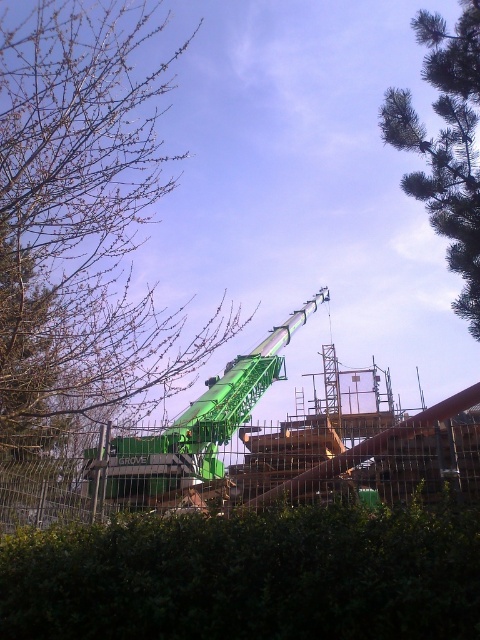
You are a construction worker on the site and need to secure a safety net between the metal wire fence at lower center and the green matte crane at center. Given their sizes, which object should the safety net be anchored to first?

The safety net should be anchored to the green matte crane at center first because it is larger than the metal wire fence at lower center, providing a more stable anchor point.

You are a construction worker carrying a tool box that is 3 meters wide. You are standing in front of the green leafy hedge at lower center and want to walk towards the camera. Is there enough space to pass through without hitting the hedge?

The distance between the green leafy hedge at lower center and the camera is 2.95 meters. Since your tool box is 3 meters wide, it is slightly wider than the available space. Therefore, you might hit the hedge if you try to pass through.

You are an inspector standing at the construction site and need to assess the visibility of the crane operator. The crane operator needs to see both the bare branches at upper left and the green leafy hedge at lower center. Which object will block the operator from seeing the other?

The bare branches at upper left is further to the viewer than green leafy hedge at lower center. Since the bare branches are closer to the operator, they will block the view of the green leafy hedge at lower center.